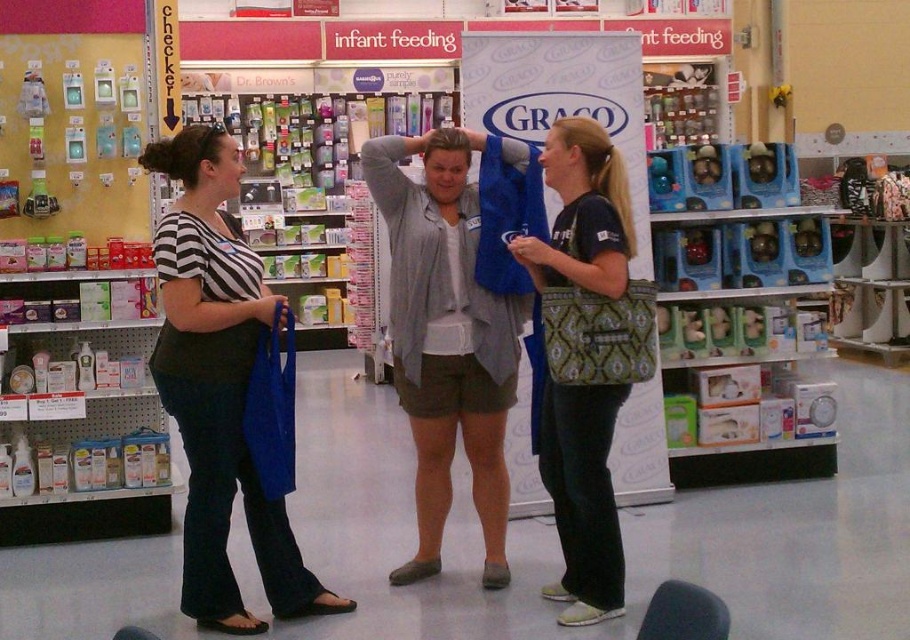
You are a store employee who needs to locate the matte black shirt at left for a customer. According to the store layout, the entrance is at the bottom of the image. Which direction should you move to find it?

Since the matte black shirt at left is positioned at point 0.606 on the x axis and 0.242 on the y axis, you should move towards the upper right direction to locate it.